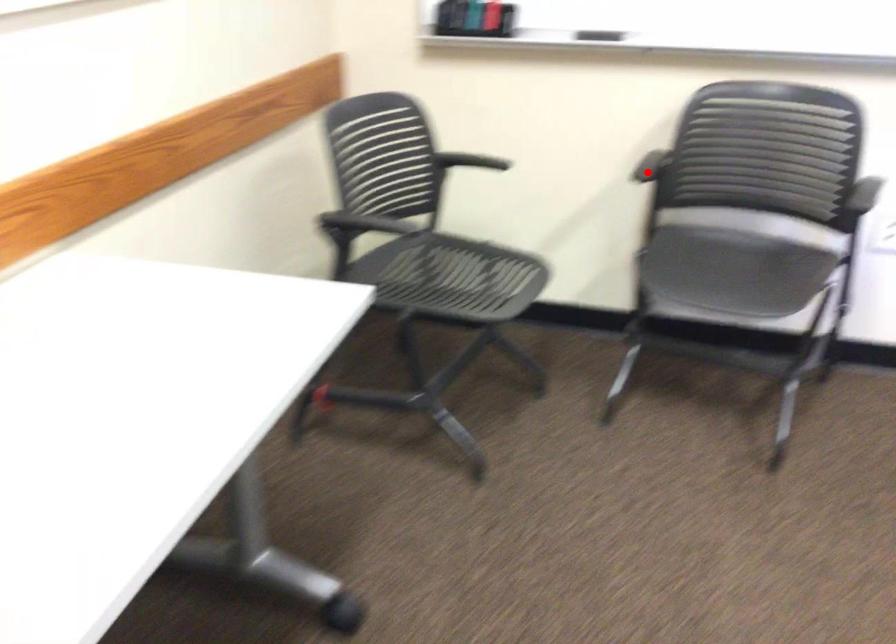
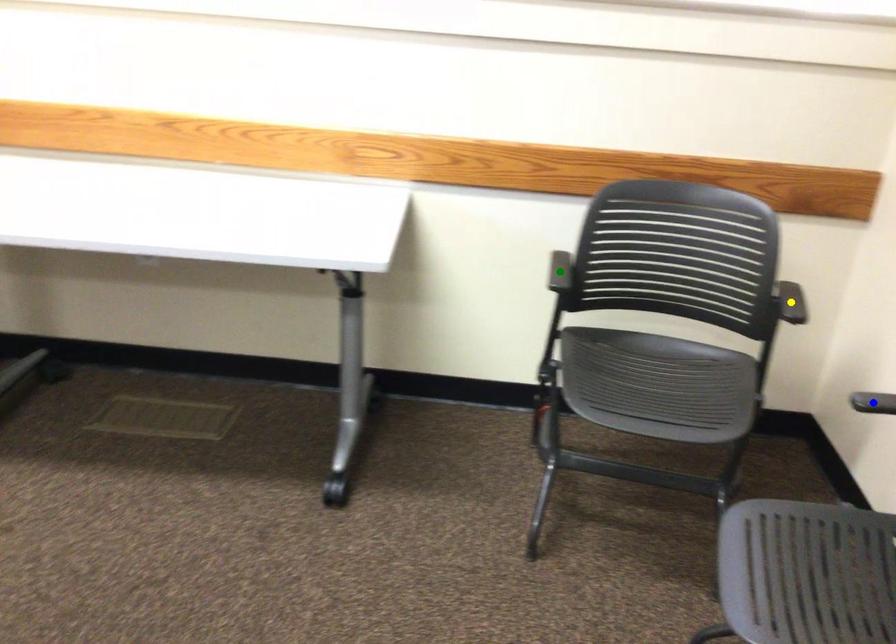
Question: I am providing you with two images of the same scene from different viewpoints. A red point is marked on the first image. You are given multiple points on the second image. Which point in image 2 represents the same 3d spot as the red point in image 1?

Choices:
 (A) blue point
 (B) yellow point
 (C) green point

Answer: (A)